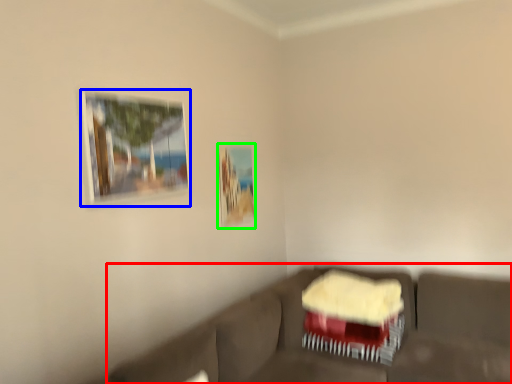
Question: Based on their relative distances, which object is farther from studio couch (highlighted by a red box)? Choose from picture frame (highlighted by a blue box) and picture frame (highlighted by a green box).

Choices:
 (A) picture frame
 (B) picture frame

Answer: (A)